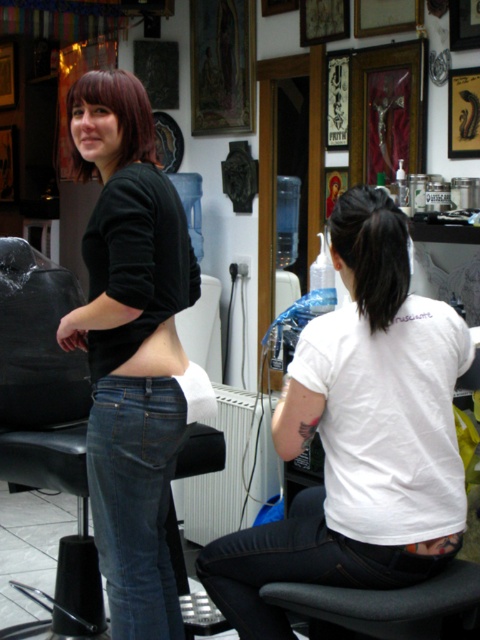
You are standing in the tattoo parlor and notice a point marked at coordinates (302, 564). Based on the scene description, what object or feature is located at this point?

The point at coordinates (302, 564) corresponds to jeans at lower left.

You are standing in the tattoo parlor and need to place a small potted plant on the floor. The plant must be placed exactly where the jeans at lower left are located. Is there enough space to place the plant there?

The jeans at lower left is located at point (302, 564), so yes, there is enough space to place the small potted plant there as the coordinates indicate an exact location on the floor.

You are a customer in the tattoo parlor and want to know which of the two points, point (152, 531) or point (237, 573), is closer to you. Based on the scene, can you determine this?

Point (152, 531) is closer to you than point (237, 573) because it is further to the camera, which means it is physically nearer in the scene.